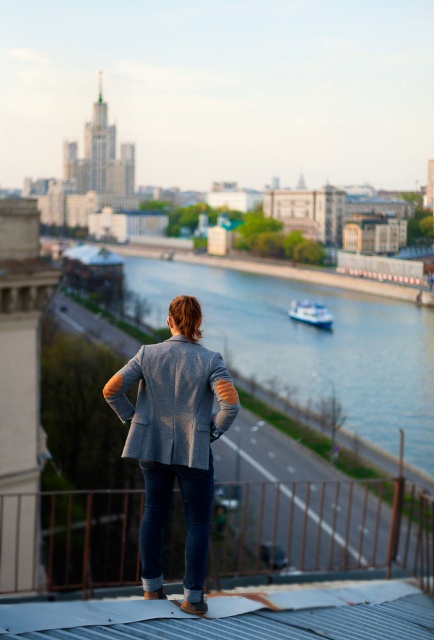
Is the position of brown metal railing at lower center less distant than that of smooth blue water at center?

That is True.

Which is more to the left, brown metal railing at lower center or smooth blue water at center?

brown metal railing at lower center

This screenshot has width=434, height=640. I want to click on brown metal railing at lower center, so (321, 528).

This screenshot has height=640, width=434. Find the location of `brown metal railing at lower center`. brown metal railing at lower center is located at coordinates (321, 528).

Can you confirm if smooth blue water at center is positioned above white glossy boat at center?

Indeed, smooth blue water at center is positioned over white glossy boat at center.

What do you see at coordinates (312, 340) in the screenshot? Image resolution: width=434 pixels, height=640 pixels. I see `smooth blue water at center` at bounding box center [312, 340].

The height and width of the screenshot is (640, 434). Find the location of `smooth blue water at center`. smooth blue water at center is located at coordinates (312, 340).

What do you see at coordinates (321, 528) in the screenshot?
I see `brown metal railing at lower center` at bounding box center [321, 528].

Identify the location of brown metal railing at lower center. Image resolution: width=434 pixels, height=640 pixels. (321, 528).